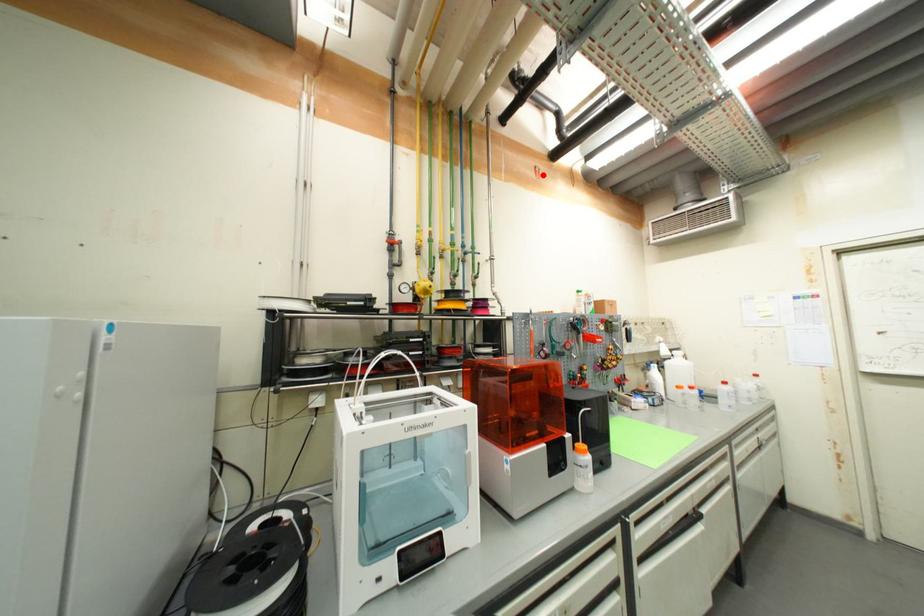
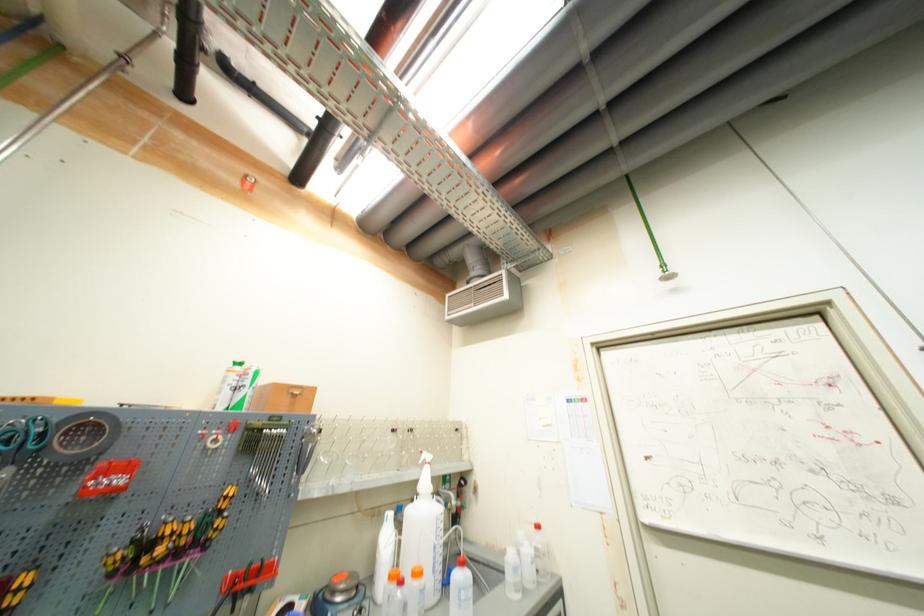
In the second image, find the point that corresponds to the highlighted location in the first image.

(253, 185)